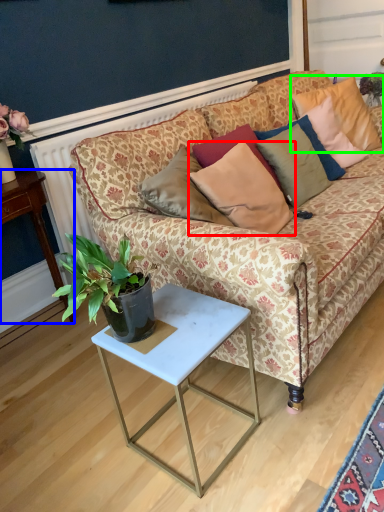
Question: Which object is the farthest from pillow (highlighted by a red box)? Choose among these: desk (highlighted by a blue box) or pillow (highlighted by a green box).

Choices:
 (A) desk
 (B) pillow

Answer: (B)